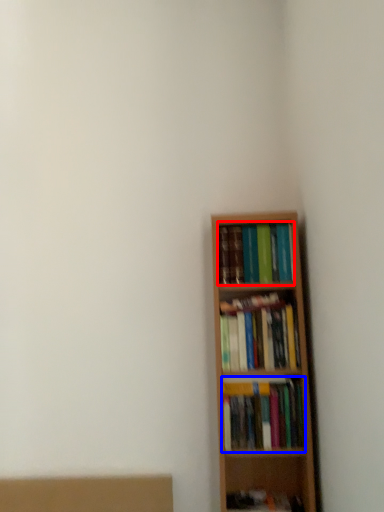
Question: Among these objects, which one is nearest to the camera, book (highlighted by a red box) or book (highlighted by a blue box)?

Choices:
 (A) book
 (B) book

Answer: (B)